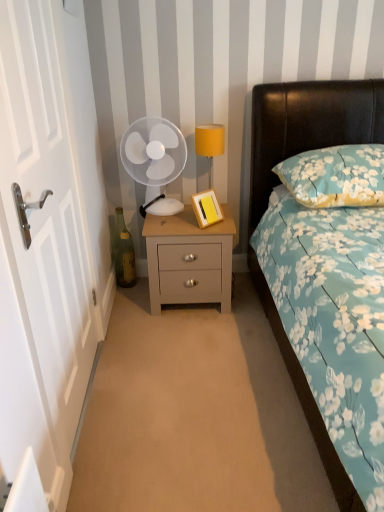
Locate an element on the screen. The image size is (384, 512). free space between matte gray nightstand at center and green glass bottle at left is located at coordinates (137, 294).